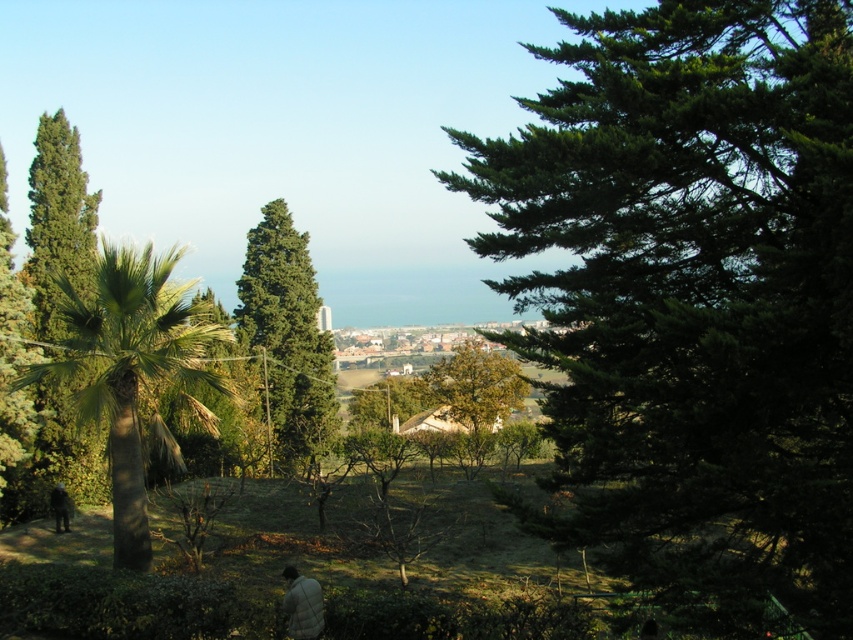
Who is more forward, (169,289) or (456,387)?

Positioned in front is point (169,289).

Is green leafy palm at left behind brown textured tree at center?

No, green leafy palm at left is in front of brown textured tree at center.

Is point (167, 323) in front of point (438, 387)?

Yes, point (167, 323) is in front of point (438, 387).

You are a GUI agent. You are given a task and a screenshot of the screen. Output one action in this format:
    pyautogui.click(x=<x>, y=<y>)
    Task: Click on the green leafy palm at left
    Image resolution: width=853 pixels, height=640 pixels.
    Given the screenshot: What is the action you would take?
    pyautogui.click(x=132, y=371)

Which of these two, green textured tree at center or white fuzzy jacket at lower center, stands taller?

green textured tree at center

Does green textured tree at center have a lesser width compared to white fuzzy jacket at lower center?

No, green textured tree at center is not thinner than white fuzzy jacket at lower center.

Find the location of `green textured tree at center`. green textured tree at center is located at coordinates (287, 339).

Who is more forward, (483,365) or (310,632)?

Point (310,632) is more forward.

Consider the image. Does brown textured tree at center appear on the left side of white fuzzy jacket at lower center?

No, brown textured tree at center is not to the left of white fuzzy jacket at lower center.

Is point (450, 400) farther from viewer compared to point (305, 588)?

Yes, it is behind point (305, 588).

Find the location of a particular element. This screenshot has height=640, width=853. brown textured tree at center is located at coordinates (479, 387).